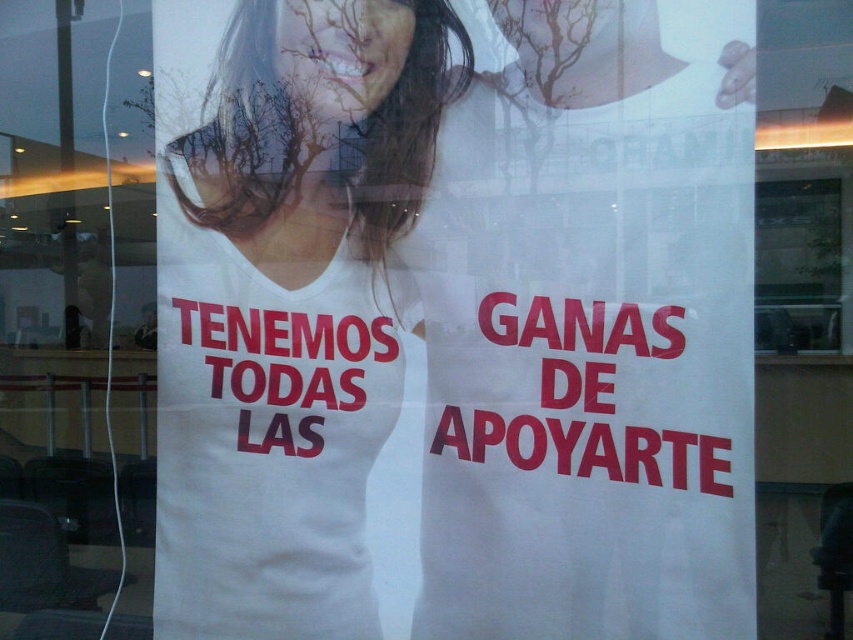
Question: Can you confirm if white matte t-shirt at center is thinner than clear glass window at upper right?

Choices:
 (A) no
 (B) yes

Answer: (A)

Question: Can you confirm if white matte t-shirt at center is thinner than clear glass window at upper right?

Choices:
 (A) no
 (B) yes

Answer: (A)

Question: Considering the relative positions of white matte t-shirt at center and clear glass window at upper right in the image provided, where is white matte t-shirt at center located with respect to clear glass window at upper right?

Choices:
 (A) right
 (B) left

Answer: (B)